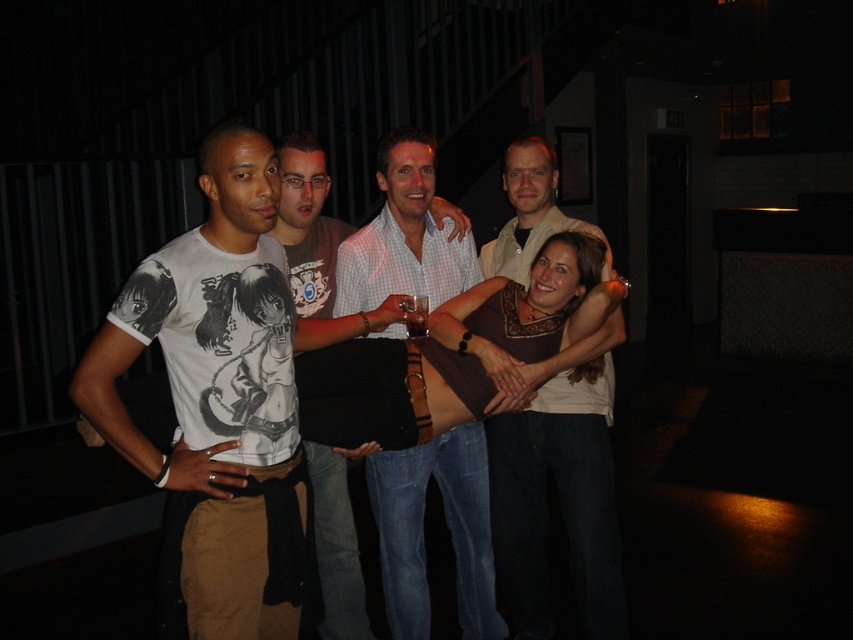
Question: Is light brown leather jacket at center to the left of translucent glass beer at center from the viewer's perspective?

Choices:
 (A) no
 (B) yes

Answer: (A)

Question: Which of these objects is positioned closest to the light brown leather jacket at center?

Choices:
 (A) translucent glass beer at center
 (B) white checkered shirt at center

Answer: (B)

Question: Which point is closer to the camera taking this photo?

Choices:
 (A) (601, 358)
 (B) (436, 280)

Answer: (A)

Question: Does white checkered shirt at center appear on the right side of translucent glass beer at center?

Choices:
 (A) no
 (B) yes

Answer: (B)

Question: Among these objects, which one is farthest from the camera?

Choices:
 (A) white checkered shirt at center
 (B) translucent glass beer at center
 (C) light brown leather jacket at center

Answer: (A)

Question: Considering the relative positions of light brown leather jacket at center and white checkered shirt at center in the image provided, where is light brown leather jacket at center located with respect to white checkered shirt at center?

Choices:
 (A) below
 (B) above

Answer: (B)